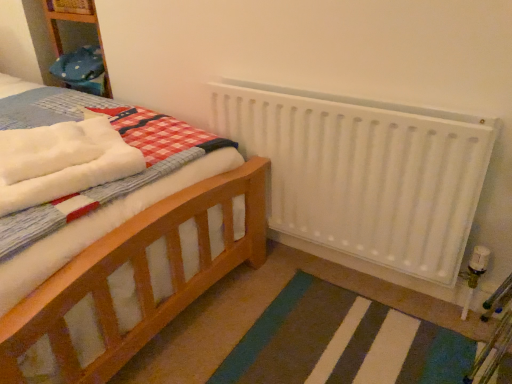
Question: Does white fluffy bath towel at left have a greater height compared to white matte radiator at upper right?

Choices:
 (A) no
 (B) yes

Answer: (A)

Question: Is white fluffy bath towel at left at the left side of white matte radiator at upper right?

Choices:
 (A) no
 (B) yes

Answer: (B)

Question: Is white fluffy bath towel at left oriented towards white matte radiator at upper right?

Choices:
 (A) no
 (B) yes

Answer: (A)

Question: Is white fluffy bath towel at left positioned far away from white matte radiator at upper right?

Choices:
 (A) yes
 (B) no

Answer: (B)

Question: Would you say white matte radiator at upper right is part of white fluffy bath towel at left's contents?

Choices:
 (A) no
 (B) yes

Answer: (A)

Question: Is white fluffy bath towel at left to the right of white matte radiator at upper right from the viewer's perspective?

Choices:
 (A) no
 (B) yes

Answer: (A)

Question: Is white fluffy bath towel at left inside white matte radiator at upper right?

Choices:
 (A) yes
 (B) no

Answer: (B)

Question: Is white matte radiator at upper right facing towards white fluffy bath towel at left?

Choices:
 (A) yes
 (B) no

Answer: (A)

Question: Can you confirm if white matte radiator at upper right is wider than white fluffy bath towel at left?

Choices:
 (A) yes
 (B) no

Answer: (B)

Question: Can you confirm if white matte radiator at upper right is thinner than white fluffy bath towel at left?

Choices:
 (A) no
 (B) yes

Answer: (B)

Question: Is white fluffy bath towel at left at the back of white matte radiator at upper right?

Choices:
 (A) yes
 (B) no

Answer: (B)

Question: From the image's perspective, would you say white matte radiator at upper right is shown under white fluffy bath towel at left?

Choices:
 (A) yes
 (B) no

Answer: (A)

Question: Do you think white matte radiator at upper right is within white fluffy bath towel at left, or outside of it?

Choices:
 (A) outside
 (B) inside

Answer: (A)